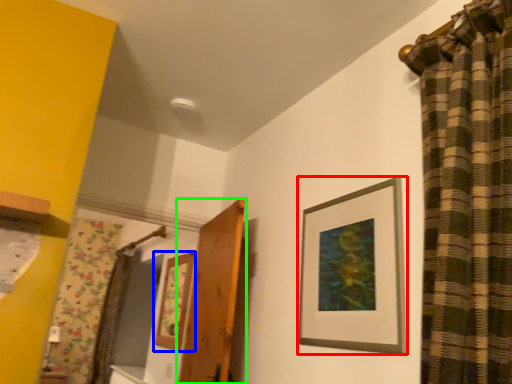
Question: Which is farther away from picture frame (highlighted by a red box)? picture frame (highlighted by a blue box) or door (highlighted by a green box)?

Choices:
 (A) picture frame
 (B) door

Answer: (A)